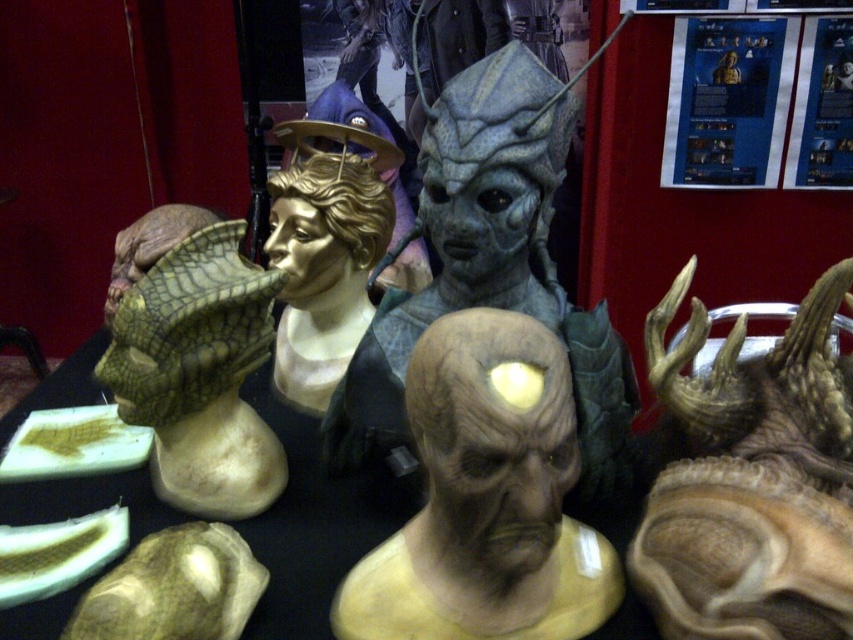
You are an art curator preparing to display the matte gray mask at center and the green scaly mask at left in a new exhibition. Given their sizes, which mask should be placed in a more prominent position to ensure visibility for visitors?

The matte gray mask at center is larger in size than the green scaly mask at left, so it should be placed in a more prominent position to ensure visibility for visitors.

You are standing in front of an exhibition of alien head sculptures. You notice two points marked on the display surface. The first point is at coordinates point (843, 513), and the second is at point (544, 504). Which of these two points is closer to you?

Point (843, 513) is further to the camera than point (544, 504), so the second point is closer to you.